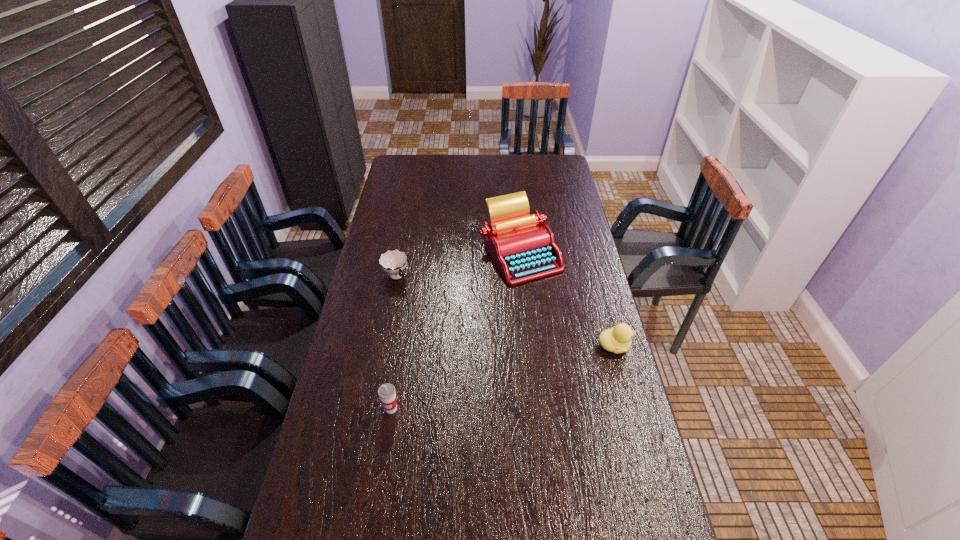
The image size is (960, 540). In the image, there is a desktop. Find the location of `vacant space at the right edge`. vacant space at the right edge is located at coordinates (581, 291).

The width and height of the screenshot is (960, 540). Identify the location of free space at the far left corner of the desktop. pyautogui.click(x=402, y=172).

The image size is (960, 540). What are the coordinates of `vacant region at the near right corner of the desktop` in the screenshot? It's located at (619, 526).

Locate an element on the screen. The width and height of the screenshot is (960, 540). free spot between the nearer cup and the second nearest object is located at coordinates (503, 377).

Identify the location of vacant space that's between the tallest object and the second tallest object. Image resolution: width=960 pixels, height=540 pixels. (456, 331).

The width and height of the screenshot is (960, 540). Identify the location of vacant space that's between the second nearest object and the nearer cup. (503, 377).

You are a GUI agent. You are given a task and a screenshot of the screen. Output one action in this format:
    pyautogui.click(x=<x>, y=<y>)
    Task: Click on the empty space between the rightmost object and the tallest object
    The image size is (960, 540).
    Given the screenshot: What is the action you would take?
    pyautogui.click(x=567, y=300)

This screenshot has width=960, height=540. I want to click on free space between the third farthest object and the farther cup, so click(505, 311).

Locate an element on the screen. The image size is (960, 540). free space between the taller cup and the rightmost object is located at coordinates (503, 377).

This screenshot has height=540, width=960. Identify the location of free spot between the rightmost object and the third shortest object. (503, 377).